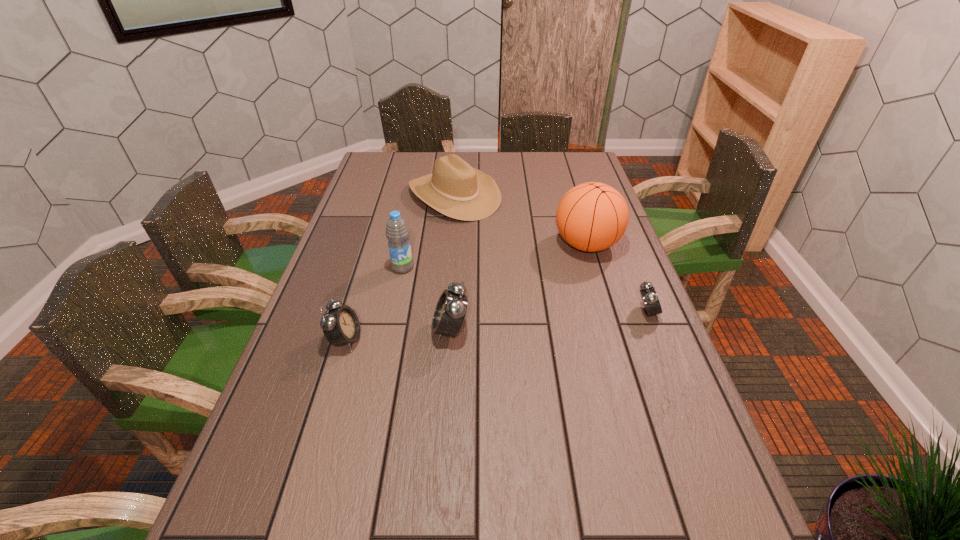
Image resolution: width=960 pixels, height=540 pixels. I want to click on the leftmost object, so click(341, 326).

Where is `the leftmost alarm clock`? Image resolution: width=960 pixels, height=540 pixels. the leftmost alarm clock is located at coordinates (341, 326).

Locate an element on the screen. Image resolution: width=960 pixels, height=540 pixels. the second alarm clock from right to left is located at coordinates (450, 311).

The image size is (960, 540). In order to click on the shortest alarm clock in this screenshot , I will do `click(649, 297)`.

Find the location of a particular element. Image resolution: width=960 pixels, height=540 pixels. the rightmost alarm clock is located at coordinates tap(649, 297).

Find the location of a particular element. This screenshot has height=540, width=960. the farthest object is located at coordinates (455, 189).

What are the coordinates of `basketball` in the screenshot? It's located at (593, 216).

This screenshot has width=960, height=540. I want to click on water bottle, so click(397, 232).

At what (x,y) coordinates should I click in order to perform the action: click on vacant space located on the face of the second tallest alarm clock. Please return your answer as a coordinate pair (x, y). The height and width of the screenshot is (540, 960). Looking at the image, I should click on [x=441, y=340].

The width and height of the screenshot is (960, 540). I want to click on free point located 0.320m on the face of the tallest alarm clock, so click(x=307, y=330).